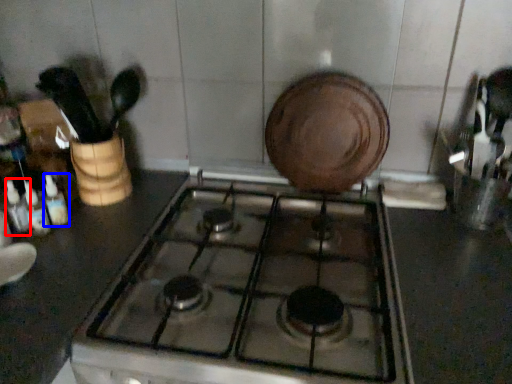
Question: Which object is further to the camera taking this photo, bottle (highlighted by a red box) or bottle (highlighted by a blue box)?

Choices:
 (A) bottle
 (B) bottle

Answer: (B)